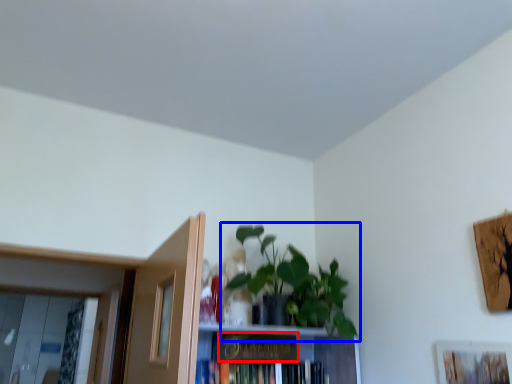
Question: Which point is closer to the camera, paperback book (highlighted by a red box) or houseplant (highlighted by a blue box)?

Choices:
 (A) paperback book
 (B) houseplant

Answer: (B)